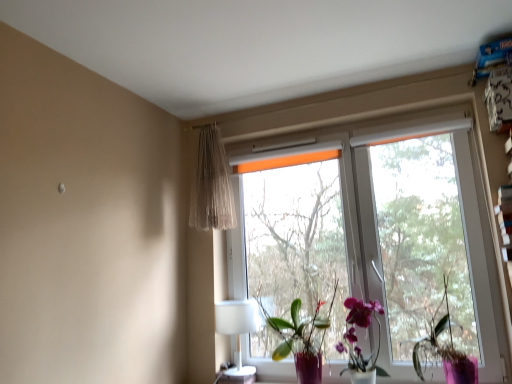
Question: Is transparent glass window at center wider than orange fabric tree at center?

Choices:
 (A) no
 (B) yes

Answer: (B)

Question: Considering the relative sizes of transparent glass window at center and orange fabric tree at center in the image provided, is transparent glass window at center thinner than orange fabric tree at center?

Choices:
 (A) no
 (B) yes

Answer: (A)

Question: Is transparent glass window at center at the right side of orange fabric tree at center?

Choices:
 (A) yes
 (B) no

Answer: (A)

Question: Is transparent glass window at center positioned in front of orange fabric tree at center?

Choices:
 (A) no
 (B) yes

Answer: (B)

Question: Is transparent glass window at center outside orange fabric tree at center?

Choices:
 (A) no
 (B) yes

Answer: (B)

Question: In terms of width, does purple matte plant at right, acting as the 2th houseplant starting from the left, look wider or thinner when compared to orange fabric tree at center?

Choices:
 (A) thin
 (B) wide

Answer: (B)

Question: Considering their positions, is purple matte plant at right, acting as the 2th houseplant starting from the left, located in front of or behind orange fabric tree at center?

Choices:
 (A) front
 (B) behind

Answer: (A)

Question: Is purple matte plant at right, the first houseplant positioned from the right, bigger or smaller than orange fabric tree at center?

Choices:
 (A) big
 (B) small

Answer: (B)

Question: Would you say purple matte plant at right, acting as the 2th houseplant starting from the left, is inside or outside orange fabric tree at center?

Choices:
 (A) outside
 (B) inside

Answer: (A)

Question: Is purple matte plant at right, the first houseplant positioned from the right, spatially inside purple glossy orchid at center, arranged as the 2th houseplant when viewed from the right, or outside of it?

Choices:
 (A) outside
 (B) inside

Answer: (A)

Question: From the image's perspective, is purple matte plant at right, acting as the 2th houseplant starting from the left, located above or below purple glossy orchid at center, which ranks as the 1th houseplant in left-to-right order?

Choices:
 (A) below
 (B) above

Answer: (B)

Question: From a real-world perspective, relative to purple glossy orchid at center, which ranks as the 1th houseplant in left-to-right order, is purple matte plant at right, the first houseplant positioned from the right, vertically above or below?

Choices:
 (A) below
 (B) above

Answer: (B)

Question: Considering the relative positions of purple matte plant at right, acting as the 2th houseplant starting from the left, and purple glossy orchid at center, which ranks as the 1th houseplant in left-to-right order, in the image provided, is purple matte plant at right, acting as the 2th houseplant starting from the left, to the left or to the right of purple glossy orchid at center, which ranks as the 1th houseplant in left-to-right order,?

Choices:
 (A) right
 (B) left

Answer: (A)

Question: Is orange fabric tree at center taller or shorter than white plastic table lamp at lower center?

Choices:
 (A) tall
 (B) short

Answer: (A)

Question: Would you say orange fabric tree at center is to the left or to the right of white plastic table lamp at lower center in the picture?

Choices:
 (A) left
 (B) right

Answer: (B)